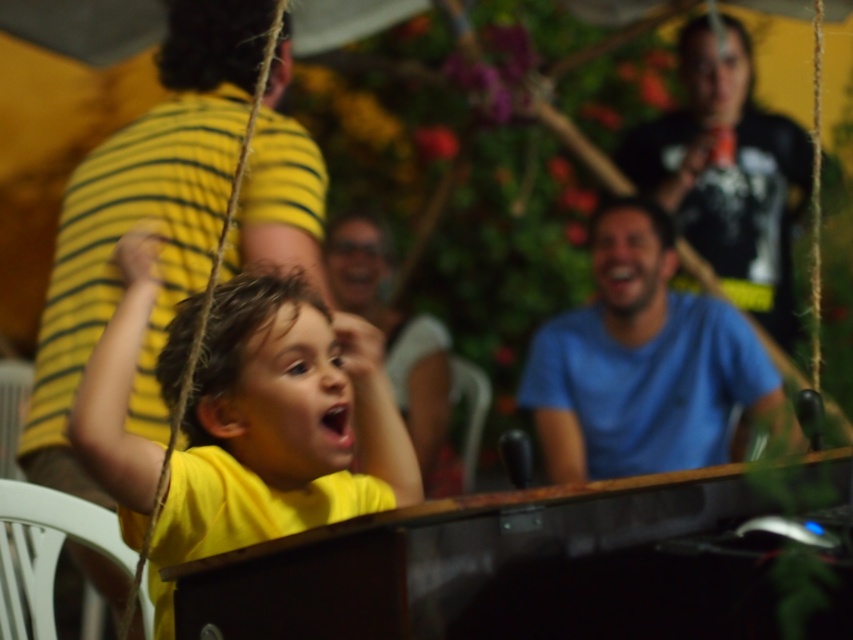
Who is more forward, (583, 326) or (393, 336)?

Point (583, 326) is more forward.

Is point (780, 428) closer to viewer compared to point (350, 307)?

Yes, it is.

Which is behind, point (601, 218) or point (397, 321)?

The point (397, 321) is behind.

Find the location of a particular element. This screenshot has height=640, width=853. blue cotton shirt at center is located at coordinates (643, 364).

Is point (207, 51) closer to viewer compared to point (693, 225)?

Yes, point (207, 51) is closer to viewer.

Can you confirm if yellow striped shirt at left is wider than matte black shirt at upper right?

No, yellow striped shirt at left is not wider than matte black shirt at upper right.

Is point (61, 298) positioned in front of point (737, 170)?

Yes, it is in front of point (737, 170).

Find the location of `yellow striped shirt at left`. yellow striped shirt at left is located at coordinates (141, 218).

In the scene shown: Which of these two, matte black shirt at upper right or matte yellow shirt at center, stands shorter?

With less height is matte yellow shirt at center.

Between point (791, 333) and point (430, 429), which one is positioned in front?

Positioned in front is point (430, 429).

What are the coordinates of `matte black shirt at upper right` in the screenshot? It's located at [x=727, y=172].